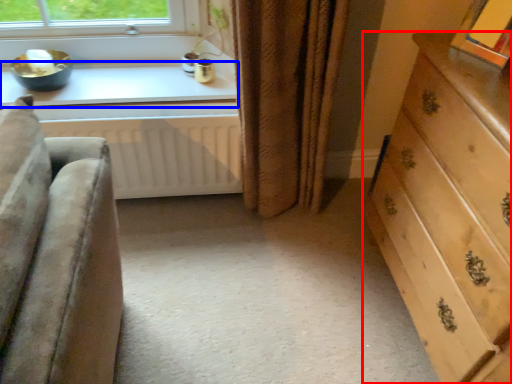
Question: Which object is further to the camera taking this photo, chest of drawers (highlighted by a red box) or window sill (highlighted by a blue box)?

Choices:
 (A) chest of drawers
 (B) window sill

Answer: (B)